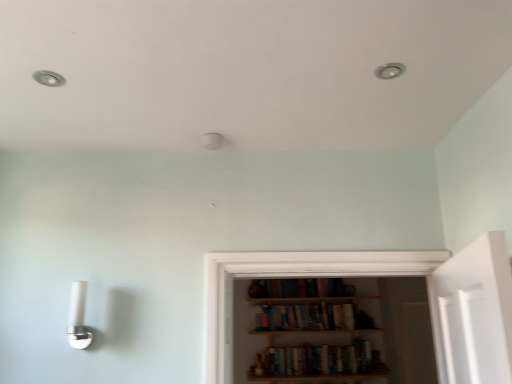
Question: Can you confirm if hardcover books at center, the 2th book when ordered from bottom to top, is thinner than hardcover books at center, the 1th book ordered from the bottom?

Choices:
 (A) yes
 (B) no

Answer: (B)

Question: Is hardcover books at center, the 2th book when ordered from bottom to top, wider than hardcover books at center, marked as the 2th book in a top-to-bottom arrangement?

Choices:
 (A) yes
 (B) no

Answer: (A)

Question: Considering the relative sizes of hardcover books at center, the 2th book when ordered from bottom to top, and hardcover books at center, the 1th book ordered from the bottom, in the image provided, is hardcover books at center, the 2th book when ordered from bottom to top, shorter than hardcover books at center, the 1th book ordered from the bottom,?

Choices:
 (A) no
 (B) yes

Answer: (B)

Question: Is hardcover books at center, the 2th book when ordered from bottom to top, positioned beyond the bounds of hardcover books at center, the 1th book ordered from the bottom?

Choices:
 (A) yes
 (B) no

Answer: (A)

Question: Is hardcover books at center, the 2th book when ordered from bottom to top, oriented away from hardcover books at center, the 1th book ordered from the bottom?

Choices:
 (A) yes
 (B) no

Answer: (B)

Question: Considering the positions of hardcover books at center, the 1th book ordered from the bottom, and white glossy sconce at lower left in the image, is hardcover books at center, the 1th book ordered from the bottom, wider or thinner than white glossy sconce at lower left?

Choices:
 (A) wide
 (B) thin

Answer: (A)

Question: Would you say hardcover books at center, the 1th book ordered from the bottom, is inside or outside white glossy sconce at lower left?

Choices:
 (A) inside
 (B) outside

Answer: (B)

Question: From their relative heights in the image, would you say hardcover books at center, the 1th book ordered from the bottom, is taller or shorter than white glossy sconce at lower left?

Choices:
 (A) short
 (B) tall

Answer: (A)

Question: From the image's perspective, is hardcover books at center, the 1th book ordered from the bottom, located above or below white glossy sconce at lower left?

Choices:
 (A) above
 (B) below

Answer: (B)

Question: Based on their positions, is white glossy sconce at lower left located to the left or right of hardcover books at center, the 1th book ordered from the bottom?

Choices:
 (A) right
 (B) left

Answer: (B)

Question: Considering the positions of white glossy sconce at lower left and hardcover books at center, marked as the 2th book in a top-to-bottom arrangement, in the image, is white glossy sconce at lower left taller or shorter than hardcover books at center, marked as the 2th book in a top-to-bottom arrangement,?

Choices:
 (A) tall
 (B) short

Answer: (A)

Question: From a real-world perspective, is white glossy sconce at lower left physically located above or below hardcover books at center, marked as the 2th book in a top-to-bottom arrangement?

Choices:
 (A) below
 (B) above

Answer: (B)

Question: From the image's perspective, is white glossy sconce at lower left above or below hardcover books at center, marked as the 2th book in a top-to-bottom arrangement?

Choices:
 (A) above
 (B) below

Answer: (A)

Question: From the image's perspective, is matte white light fixture at upper left above or below hardcover books at center, marked as the 2th book in a top-to-bottom arrangement?

Choices:
 (A) above
 (B) below

Answer: (A)

Question: Considering the relative positions of matte white light fixture at upper left and hardcover books at center, marked as the 2th book in a top-to-bottom arrangement, in the image provided, is matte white light fixture at upper left to the left or to the right of hardcover books at center, marked as the 2th book in a top-to-bottom arrangement,?

Choices:
 (A) left
 (B) right

Answer: (A)